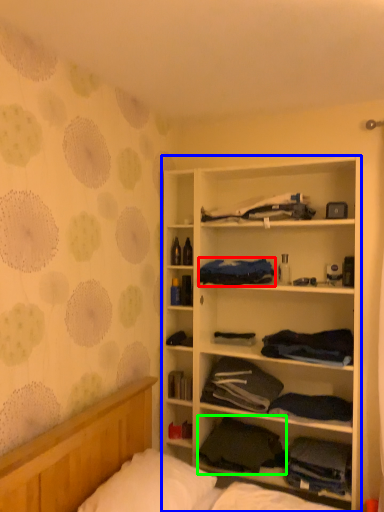
Question: Which is farther away from clothing (highlighted by a red box)? cabinetry (highlighted by a blue box) or clothing (highlighted by a green box)?

Choices:
 (A) cabinetry
 (B) clothing

Answer: (B)